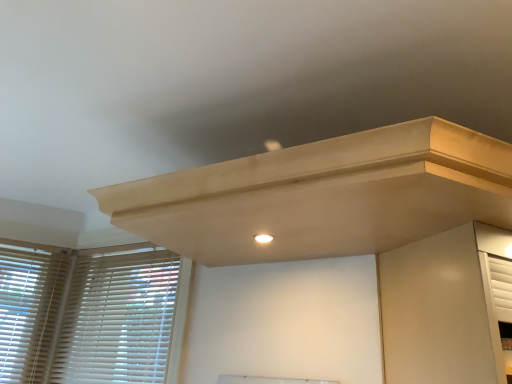
In order to click on white wood blinds at left in this screenshot , I will do `click(91, 313)`.

The image size is (512, 384). What do you see at coordinates (91, 313) in the screenshot?
I see `white wood blinds at left` at bounding box center [91, 313].

At what (x,y) coordinates should I click in order to perform the action: click on white wood blinds at left. Please return your answer as a coordinate pair (x, y). Looking at the image, I should click on (91, 313).